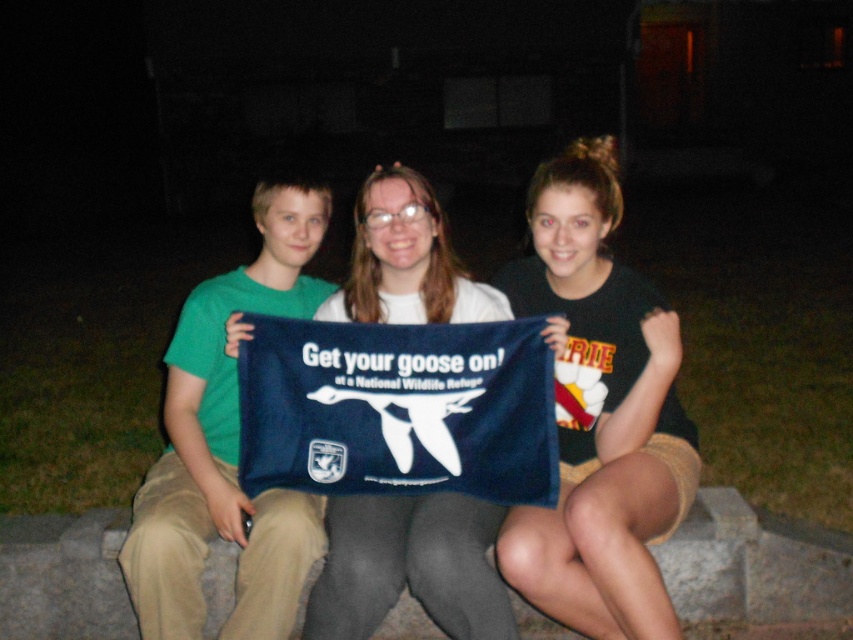
Which is in front, point (585, 305) or point (450, 266)?

Point (585, 305)

Does dark blue fabric towel at center appear over white fabric towel at center?

Correct, dark blue fabric towel at center is located above white fabric towel at center.

Image resolution: width=853 pixels, height=640 pixels. I want to click on dark blue fabric towel at center, so click(x=599, y=413).